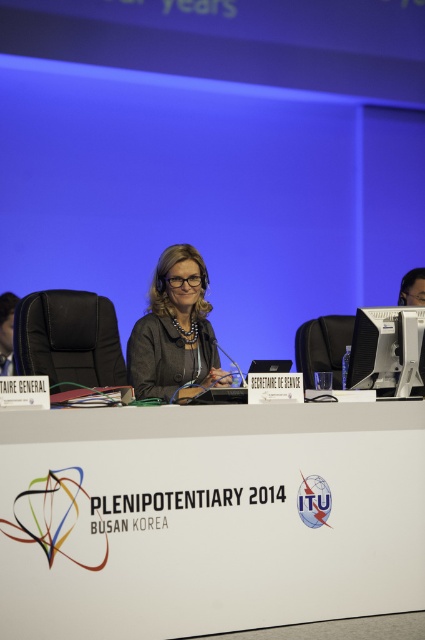
Question: Considering the real-world distances, which object is closest to the matte black jacket at center?

Choices:
 (A) white plastic table at center
 (B) sleek black monitor at center

Answer: (A)

Question: Does matte black jacket at center appear under sleek black monitor at center?

Choices:
 (A) no
 (B) yes

Answer: (A)

Question: Is matte black jacket at center behind sleek black monitor at center?

Choices:
 (A) yes
 (B) no

Answer: (B)

Question: Which object is the farthest from the white plastic table at center?

Choices:
 (A) sleek black monitor at center
 (B) matte black jacket at center

Answer: (B)

Question: Does matte black jacket at center have a larger size compared to sleek black monitor at center?

Choices:
 (A) yes
 (B) no

Answer: (A)

Question: Which of the following is the farthest from the observer?

Choices:
 (A) (362, 368)
 (B) (263, 584)

Answer: (A)